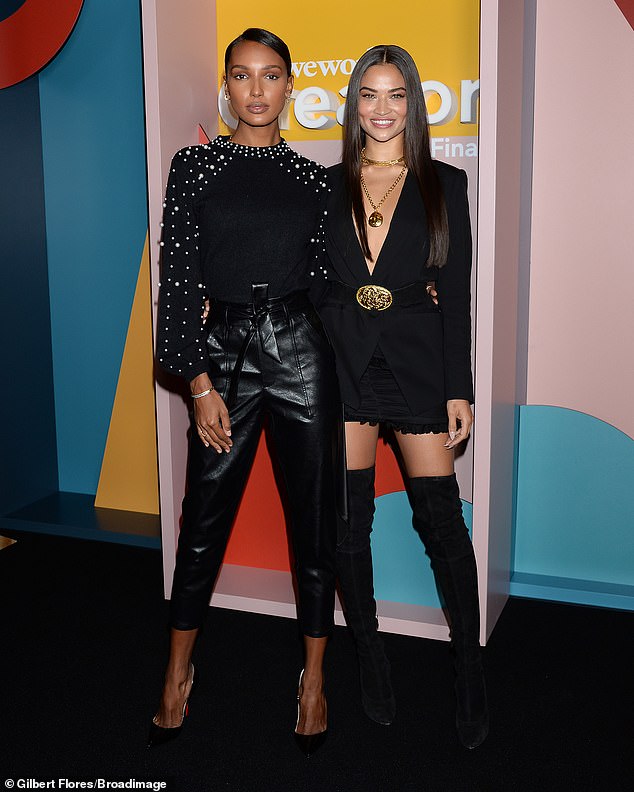
You are a GUI agent. You are given a task and a screenshot of the screen. Output one action in this format:
    pyautogui.click(x=<x>, y=<y>)
    Task: Click on the jet black floor
    This screenshot has height=792, width=634.
    Given the screenshot: What is the action you would take?
    pyautogui.click(x=416, y=674), pyautogui.click(x=390, y=767), pyautogui.click(x=540, y=763), pyautogui.click(x=541, y=641), pyautogui.click(x=605, y=686), pyautogui.click(x=243, y=729), pyautogui.click(x=242, y=657), pyautogui.click(x=87, y=713), pyautogui.click(x=111, y=625), pyautogui.click(x=37, y=598)